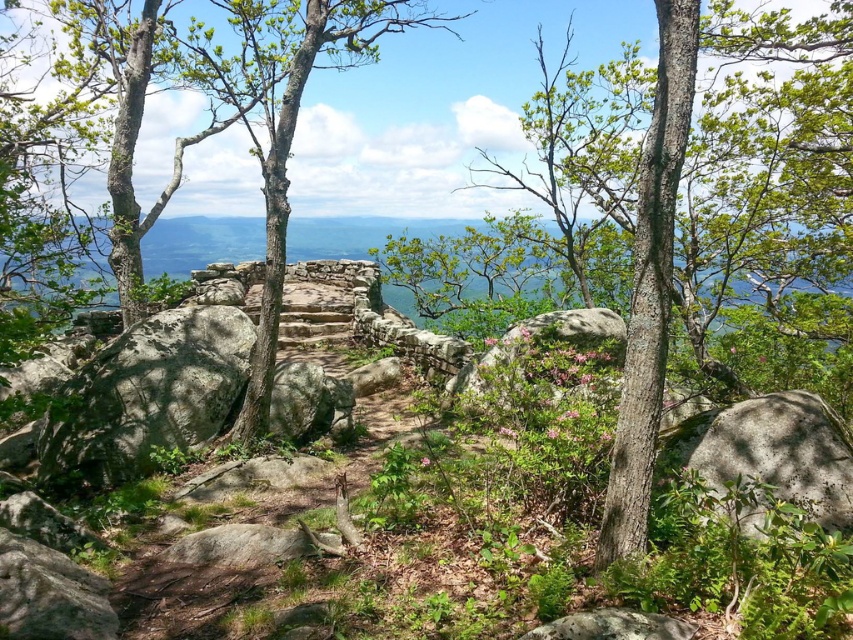
Question: Is green rough bark tree at center in front of gray rough rock at lower right?

Choices:
 (A) yes
 (B) no

Answer: (B)

Question: Which point is farther to the camera?

Choices:
 (A) gray rough rock at left
 (B) green rough bark tree at center

Answer: (A)

Question: Which object is the farthest from the green rough bark tree at center?

Choices:
 (A) gray rough rock at left
 (B) gray rough rock at lower right

Answer: (A)

Question: Where is green rough bark tree at center located in relation to gray rough rock at left in the image?

Choices:
 (A) left
 (B) right

Answer: (B)

Question: Is green rough bark tree at center bigger than gray rough rock at left?

Choices:
 (A) no
 (B) yes

Answer: (B)

Question: Which point is closer to the camera taking this photo?

Choices:
 (A) (531, 140)
 (B) (181, 317)
 (C) (729, 460)

Answer: (C)